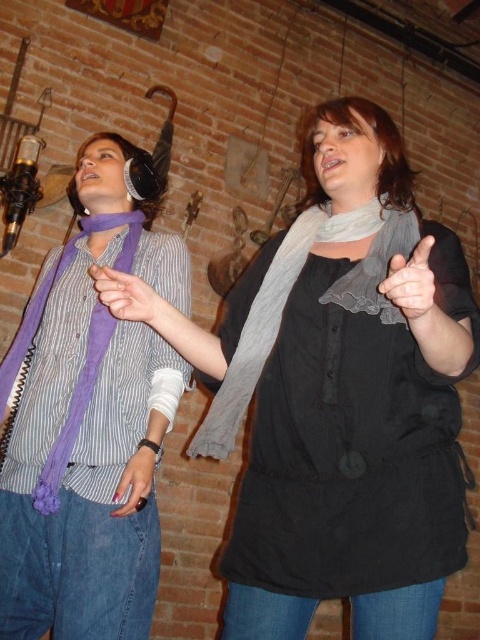
Question: Among these objects, which one is nearest to the camera?

Choices:
 (A) gray textured scarf at center
 (B) purple soft scarf at left
 (C) white matte scarf at center

Answer: (A)

Question: Can you confirm if gray textured scarf at center is bigger than purple fabric scarf at left?

Choices:
 (A) no
 (B) yes

Answer: (B)

Question: Which object appears farthest from the camera in this image?

Choices:
 (A) purple soft scarf at left
 (B) gray textured scarf at center
 (C) purple fabric scarf at left

Answer: (A)

Question: Which of the following is the closest to the observer?

Choices:
 (A) (24, 589)
 (B) (51, 492)
 (C) (348, 204)
 (D) (132, 202)

Answer: (C)

Question: Can you confirm if matte black hand at center is thinner than purple scarf at center?

Choices:
 (A) yes
 (B) no

Answer: (A)

Question: Does matte black scarf at center have a lesser width compared to white matte scarf at center?

Choices:
 (A) yes
 (B) no

Answer: (B)